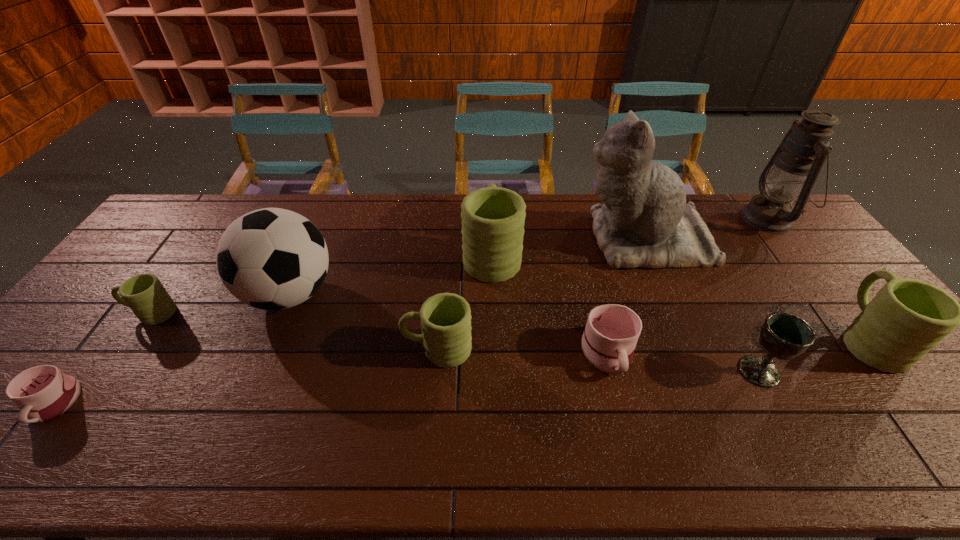
Find the location of `cat`. cat is located at coordinates (645, 222).

Where is `brown oil lamp`? brown oil lamp is located at coordinates (792, 171).

Locate an element on the screen. the eighth object from right to left is located at coordinates (272, 259).

The image size is (960, 540). What are the coordinates of `soccer ball` in the screenshot? It's located at (272, 259).

Locate an element on the screen. This screenshot has height=540, width=960. the seventh shortest object is located at coordinates (493, 218).

The width and height of the screenshot is (960, 540). What are the coordinates of `the tallest mug` in the screenshot? It's located at (493, 218).

This screenshot has width=960, height=540. Find the location of `the second tallest mug`. the second tallest mug is located at coordinates (907, 318).

Identify the location of the second biggest green mug. The width and height of the screenshot is (960, 540). (907, 318).

This screenshot has width=960, height=540. In order to click on chalice in this screenshot , I will do `click(785, 336)`.

Where is `the third tallest mug`? the third tallest mug is located at coordinates (445, 318).